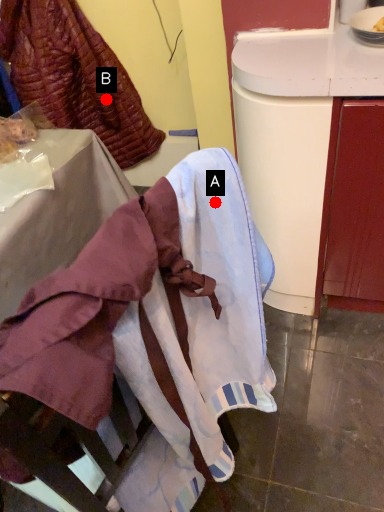
Question: Two points are circled on the image, labeled by A and B beside each circle. Which point is closer to the camera taking this photo?

Choices:
 (A) A is closer
 (B) B is closer

Answer: (A)